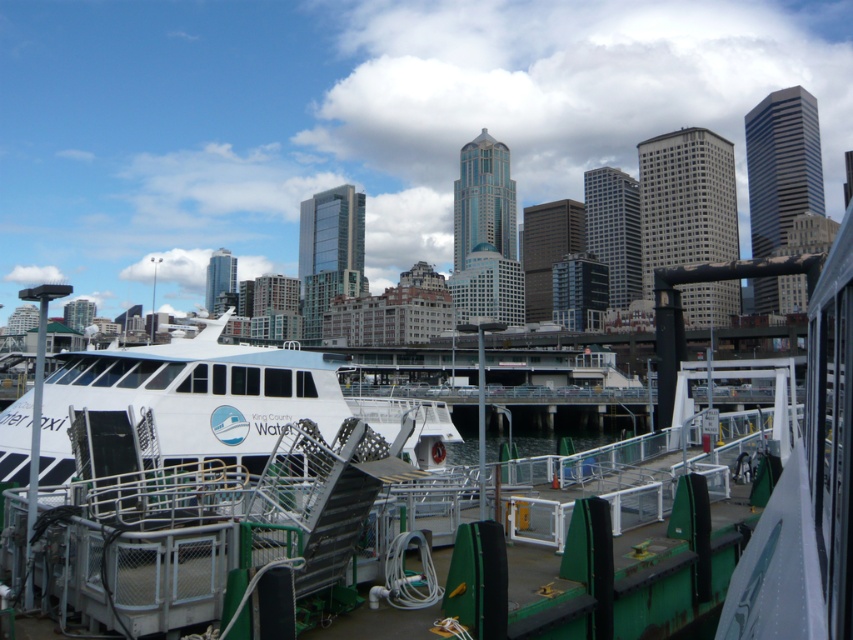
Can you confirm if white glossy ferry at center is taller than clear water at dock center?

No.

Is point (274, 349) positioned before point (537, 440)?

Yes, it is.

In order to click on white glossy ferry at center in this screenshot , I will do `click(198, 401)`.